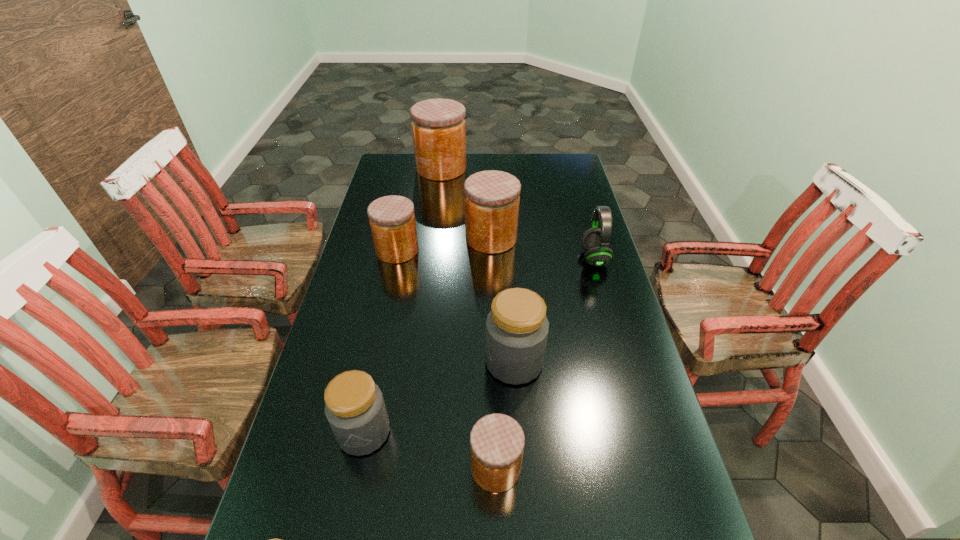
You are a GUI agent. You are given a task and a screenshot of the screen. Output one action in this format:
    pyautogui.click(x=<x>, y=<y>)
    Task: Click on the vacant space located on the right of the tallest object
    
    Given the screenshot: What is the action you would take?
    pos(485,168)

The image size is (960, 540). Find the location of `free space located 0.050m on the right of the third smallest orange jar`. free space located 0.050m on the right of the third smallest orange jar is located at coordinates (531, 238).

The height and width of the screenshot is (540, 960). Identify the location of free space located on the surface of the fourth nearest jar near the warning symbol. (390, 362).

Identify the location of free region located on the surface of the fourth nearest jar near the warning symbol. This screenshot has height=540, width=960. pyautogui.click(x=434, y=362).

The width and height of the screenshot is (960, 540). What are the coordinates of `free space located on the surface of the fourth nearest jar near the warning symbol` in the screenshot? It's located at (456, 362).

The width and height of the screenshot is (960, 540). Find the location of `free space located on the ear cups of the headset`. free space located on the ear cups of the headset is located at coordinates (546, 258).

Identify the location of vacant space located on the ear cups of the headset. (488, 258).

Identify the location of free point located on the ear cups of the headset. click(479, 258).

Identify the location of vacant space located on the surface of the second biggest gray jar near the warning symbol. The image size is (960, 540). (351, 494).

At what (x,y) coordinates should I click in order to perform the action: click on vacant point located 0.370m on the front of the third biggest orange jar. Please return your answer as a coordinate pair (x, y). Looking at the image, I should click on (375, 353).